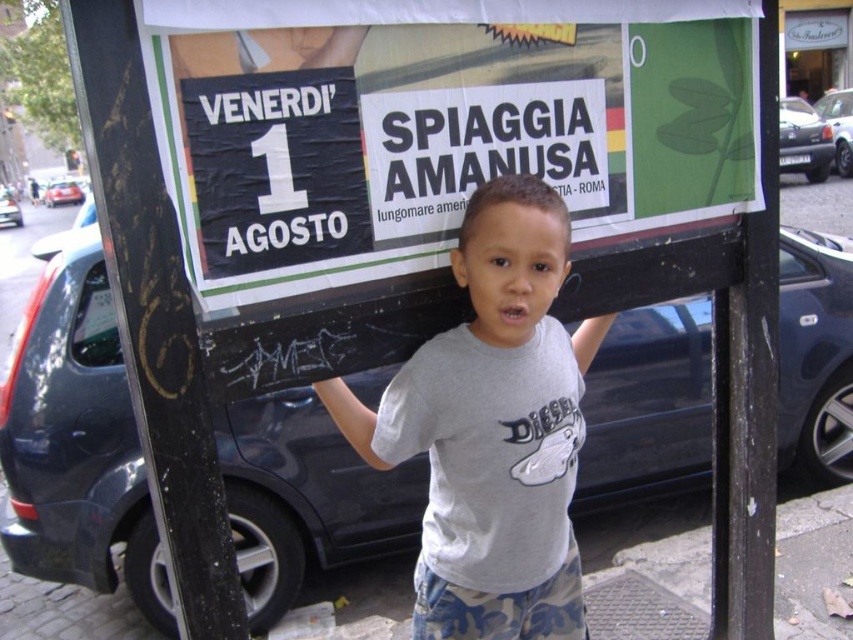
Question: Among these points, which one is nearest to the camera?

Choices:
 (A) (840, 173)
 (B) (254, 246)
 (C) (15, 214)
 (D) (64, 189)

Answer: (B)

Question: Does gray cotton shirt at center have a greater width compared to metallic silver car at right?

Choices:
 (A) no
 (B) yes

Answer: (A)

Question: Is metallic blue car at center bigger than silver metallic sedan at right?

Choices:
 (A) yes
 (B) no

Answer: (B)

Question: Among these objects, which one is nearest to the camera?

Choices:
 (A) metallic silver car at right
 (B) silver metallic sedan at right
 (C) metallic silver car at left

Answer: (B)

Question: Which object appears closest to the camera in this image?

Choices:
 (A) gray cotton shirt at center
 (B) metallic silver car at left
 (C) silver metallic sedan at right

Answer: (A)

Question: Can you confirm if metallic blue car at center is positioned to the left of metallic silver car at left?

Choices:
 (A) yes
 (B) no

Answer: (B)